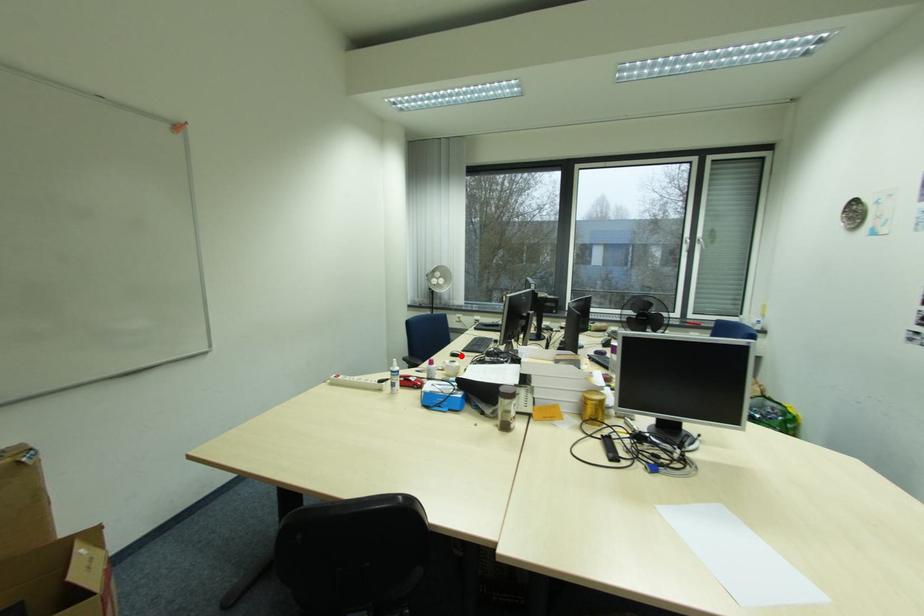
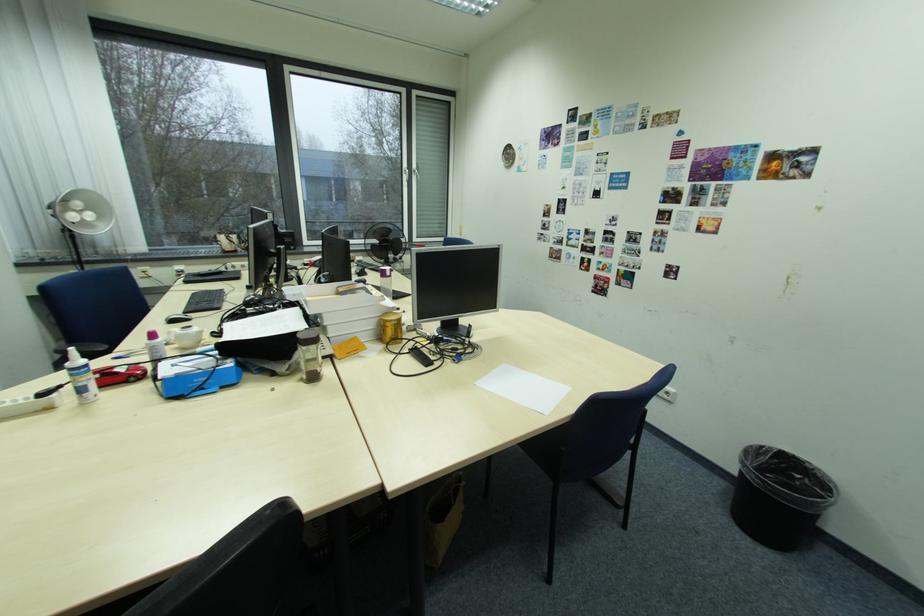
Locate, in the second image, the point that corresponds to the highlighted location in the first image.

(180, 322)